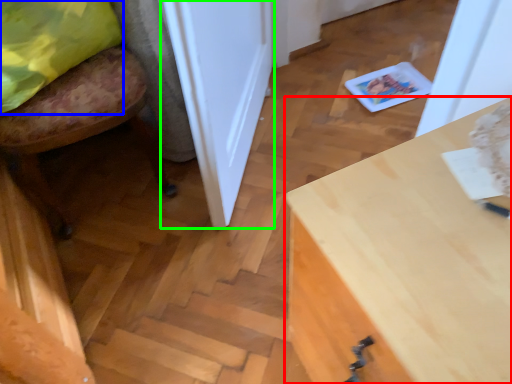
Question: Based on their relative distances, which object is nearer to desk (highlighted by a red box)? Choose from pillow (highlighted by a blue box) and door (highlighted by a green box).

Choices:
 (A) pillow
 (B) door

Answer: (B)